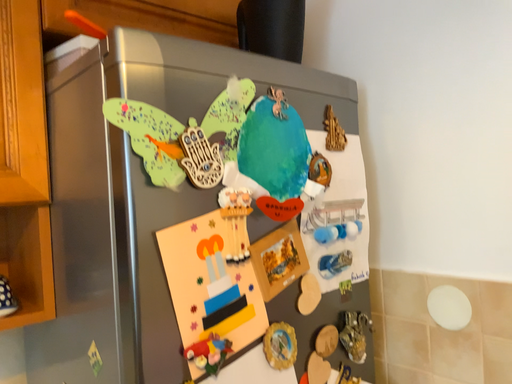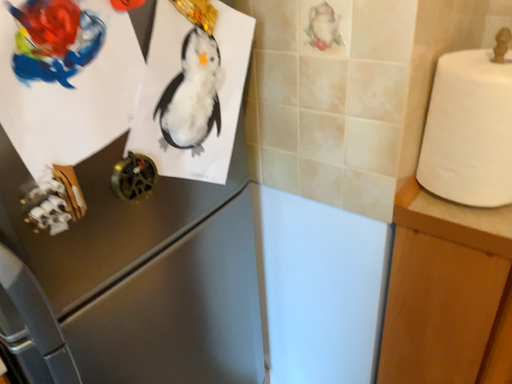
Question: Which way did the camera rotate in the video?

Choices:
 (A) rotated downward
 (B) rotated upward

Answer: (A)